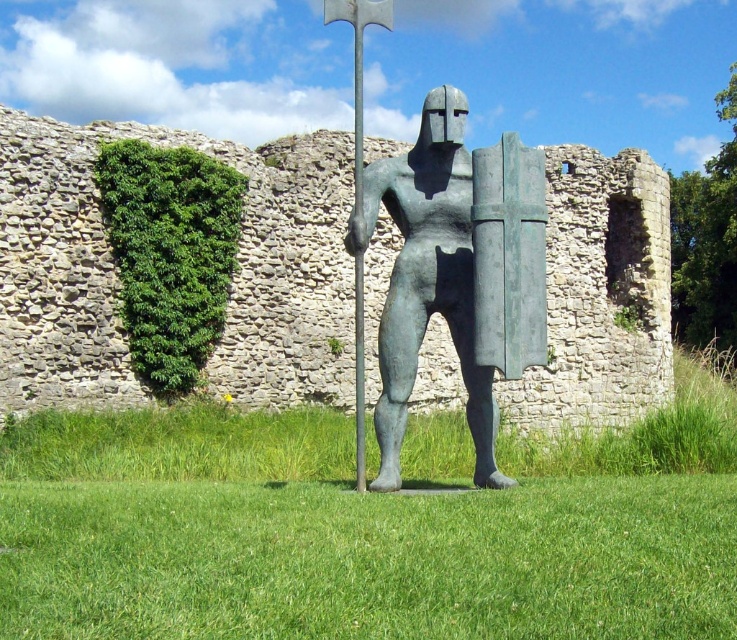
You are a gardener who needs to water the green grass at center. You have a hose that can reach up to 7 meters. The bronze statue at center is in the way. Can you water the grass without moving the statue?

The distance between the green grass at center and bronze statue at center is 7.30 meters. Since the hose can only reach up to 7 meters, you cannot water the grass without moving the statue.